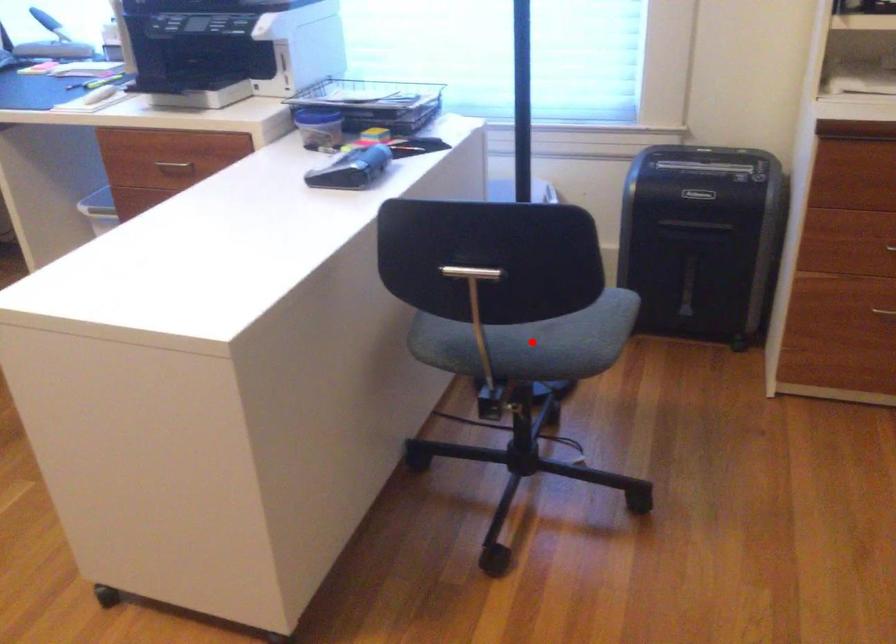
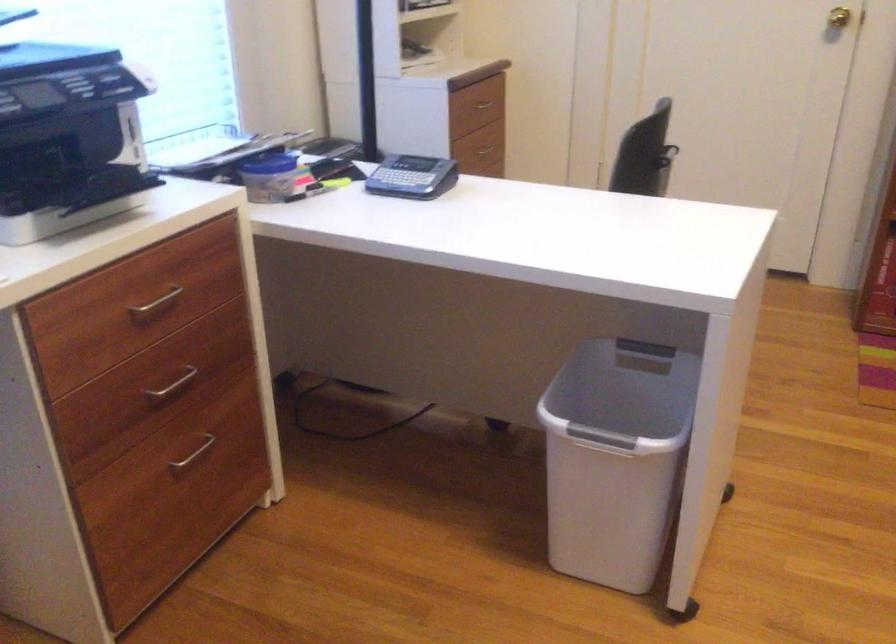
Question: I am providing you with two images of the same scene from different viewpoints. A red point is marked on the first image. Is the red point's position out of view in image 2?

Choices:
 (A) Yes
 (B) No

Answer: (A)